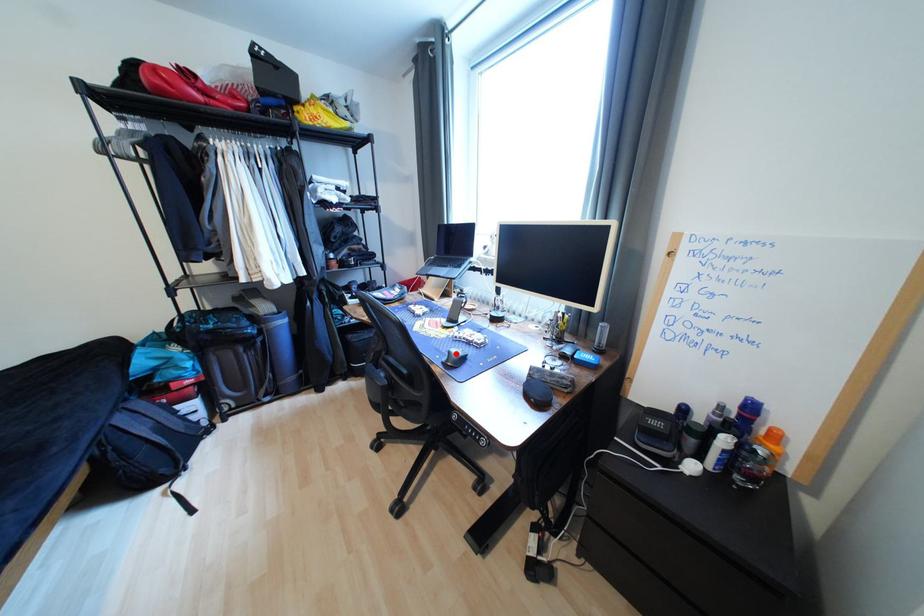
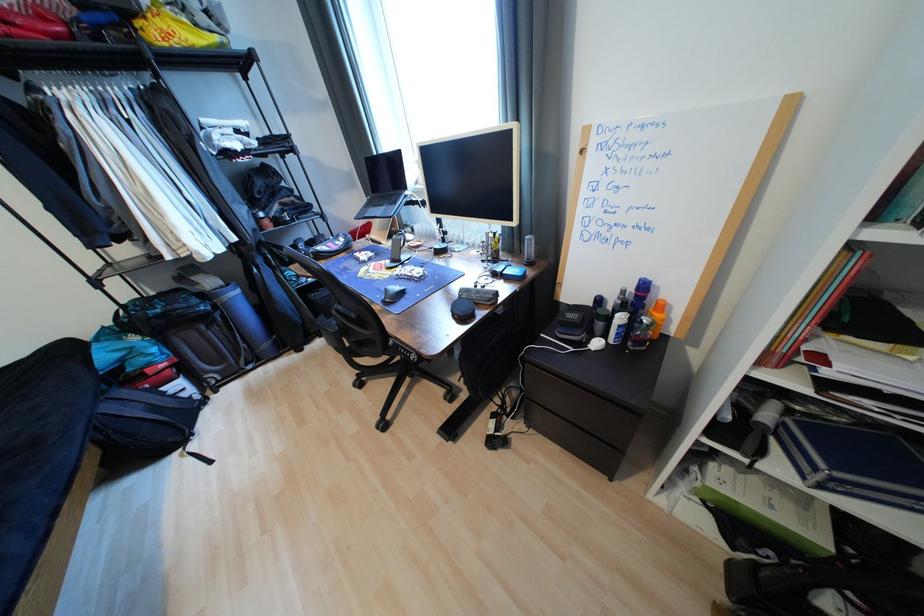
The point at the highlighted location is marked in the first image. Where is the corresponding point in the second image?

(393, 292)